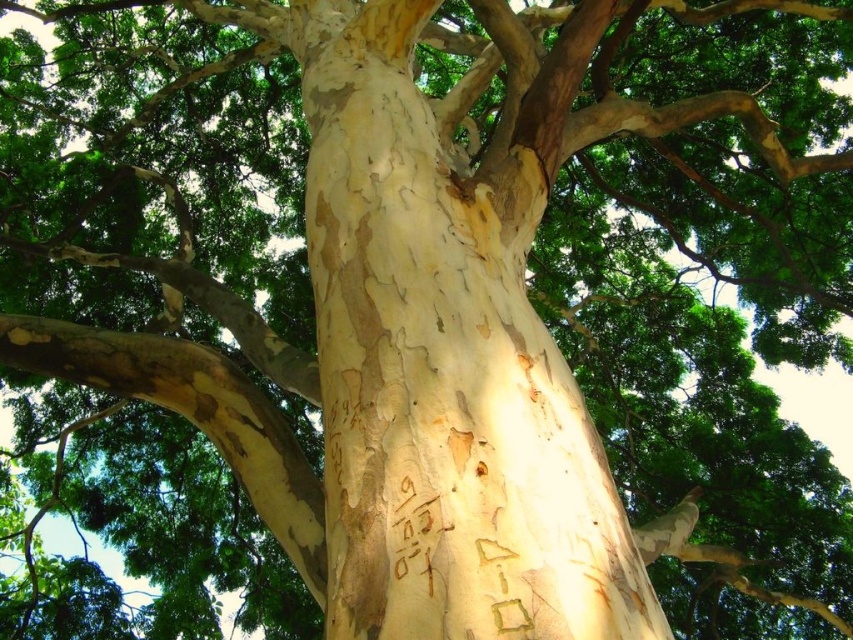
Question: Can you confirm if white textured bark at center is positioned below brown rough bark at center?

Choices:
 (A) no
 (B) yes

Answer: (A)

Question: Is white textured bark at center positioned in front of brown rough bark at center?

Choices:
 (A) yes
 (B) no

Answer: (B)

Question: Among these points, which one is farthest from the camera?

Choices:
 (A) [447, 625]
 (B) [483, 22]

Answer: (B)

Question: Is white textured bark at center positioned in front of brown rough bark at center?

Choices:
 (A) yes
 (B) no

Answer: (B)

Question: Which object is farther from the camera taking this photo?

Choices:
 (A) brown rough bark at center
 (B) white textured bark at center

Answer: (B)